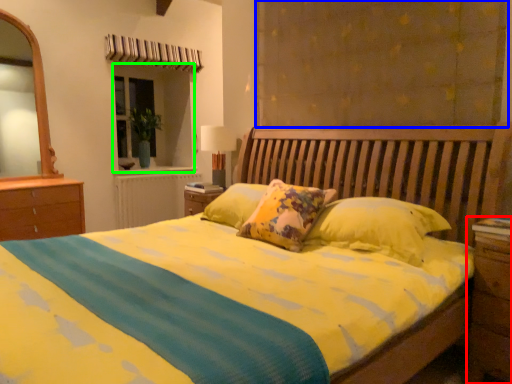
Question: Estimate the real-world distances between objects in this image. Which object is farther from nightstand (highlighted by a red box), curtain (highlighted by a blue box) or window (highlighted by a green box)?

Choices:
 (A) curtain
 (B) window

Answer: (B)